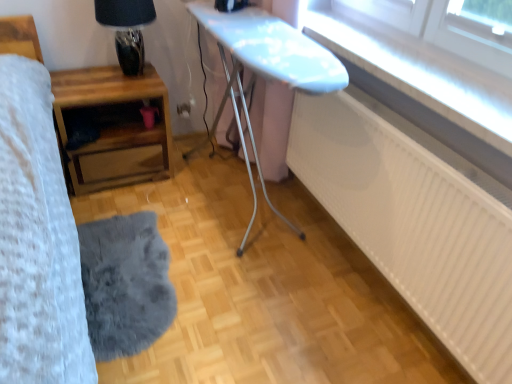
Locate an element on the screen. free area in between wooden nightstand at left, which ranks as the second table in right-to-left order, and white glossy ironing board at center, which appears as the first table when viewed from the right is located at coordinates (164, 221).